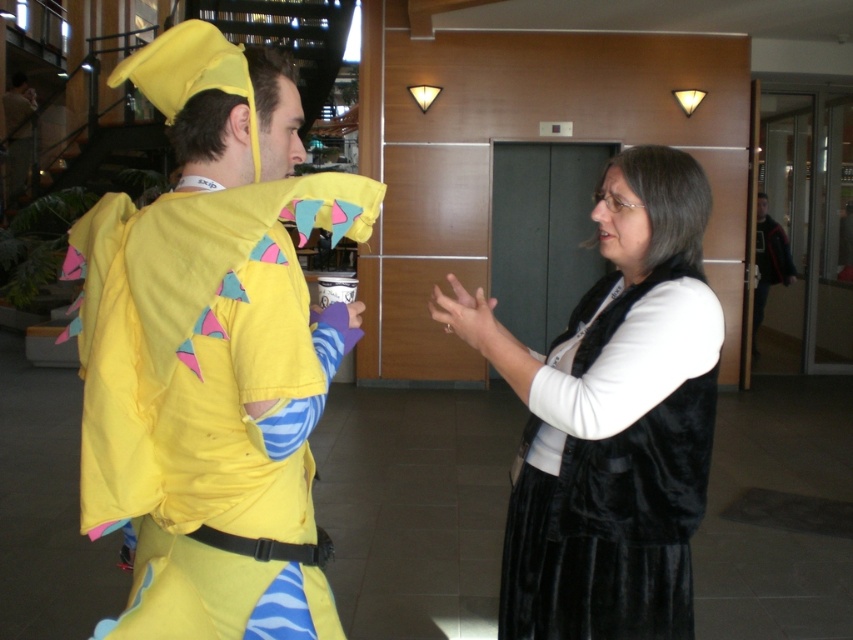
Can you confirm if velvet black vest at center is bigger than dark gray sweater at right?

No.

Image resolution: width=853 pixels, height=640 pixels. I want to click on velvet black vest at center, so click(x=612, y=419).

This screenshot has width=853, height=640. What do you see at coordinates (612, 419) in the screenshot?
I see `velvet black vest at center` at bounding box center [612, 419].

The width and height of the screenshot is (853, 640). I want to click on velvet black vest at center, so click(612, 419).

Who is more forward, (216, 326) or (648, 362)?

Point (216, 326)

Is matte yellow costume at left shorter than velvet black vest at center?

Yes, matte yellow costume at left is shorter than velvet black vest at center.

Find the location of a particular element. Image resolution: width=853 pixels, height=640 pixels. matte yellow costume at left is located at coordinates (212, 353).

Locate an element on the screen. This screenshot has width=853, height=640. matte yellow costume at left is located at coordinates (212, 353).

This screenshot has width=853, height=640. I want to click on matte yellow costume at left, so click(212, 353).

Consider the image. Who is more forward, (141, 257) or (776, 268)?

Positioned in front is point (141, 257).

Where is `matte yellow costume at left`? This screenshot has width=853, height=640. matte yellow costume at left is located at coordinates (212, 353).